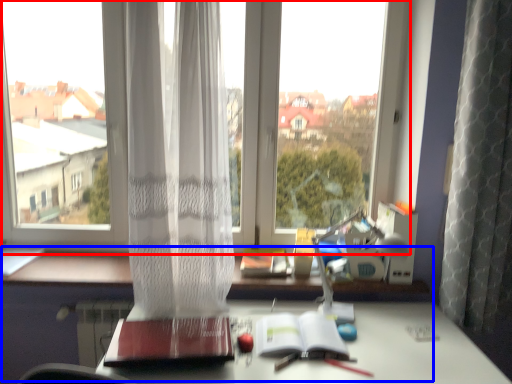
Question: Among these objects, which one is nearest to the camera, window (highlighted by a red box) or computer desk (highlighted by a blue box)?

Choices:
 (A) window
 (B) computer desk

Answer: (B)